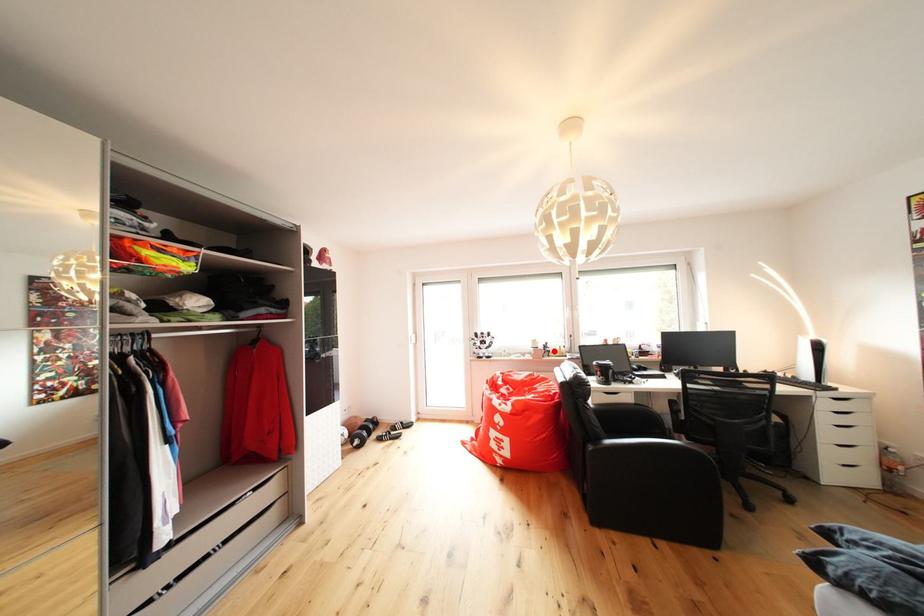
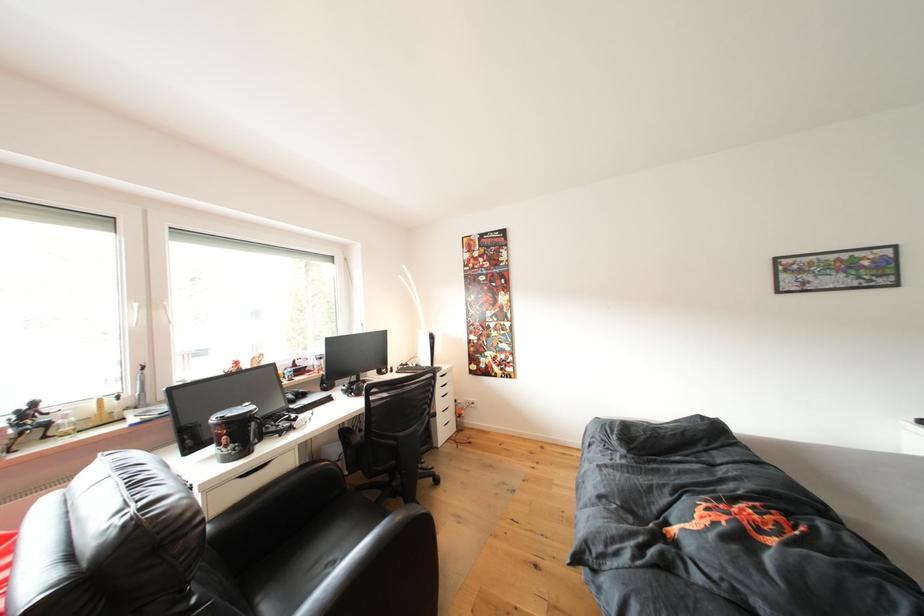
Find the pixel in the second image that matches the highlighted location in the first image.

(35, 419)